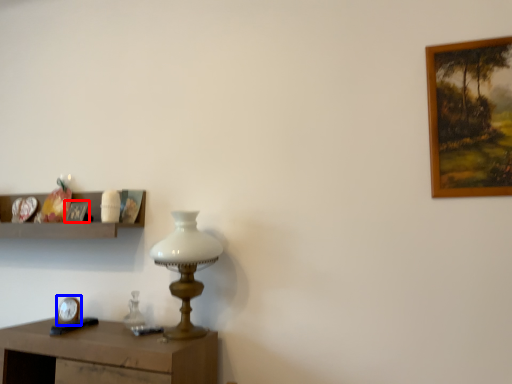
Question: Which point is further to the camera, picture frame (highlighted by a red box) or clock (highlighted by a blue box)?

Choices:
 (A) picture frame
 (B) clock

Answer: (A)